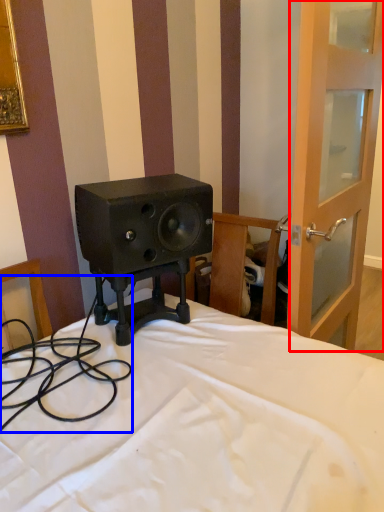
Question: Which of the following is the farthest to the observer, screen door (highlighted by a red box) or cable (highlighted by a blue box)?

Choices:
 (A) screen door
 (B) cable

Answer: (A)